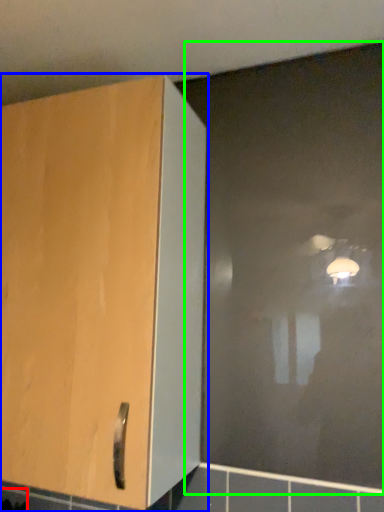
Question: Considering the real-world distances, which object is farthest from ceramic tile (highlighted by a red box)? cupboard (highlighted by a blue box) or glass door (highlighted by a green box)?

Choices:
 (A) cupboard
 (B) glass door

Answer: (B)